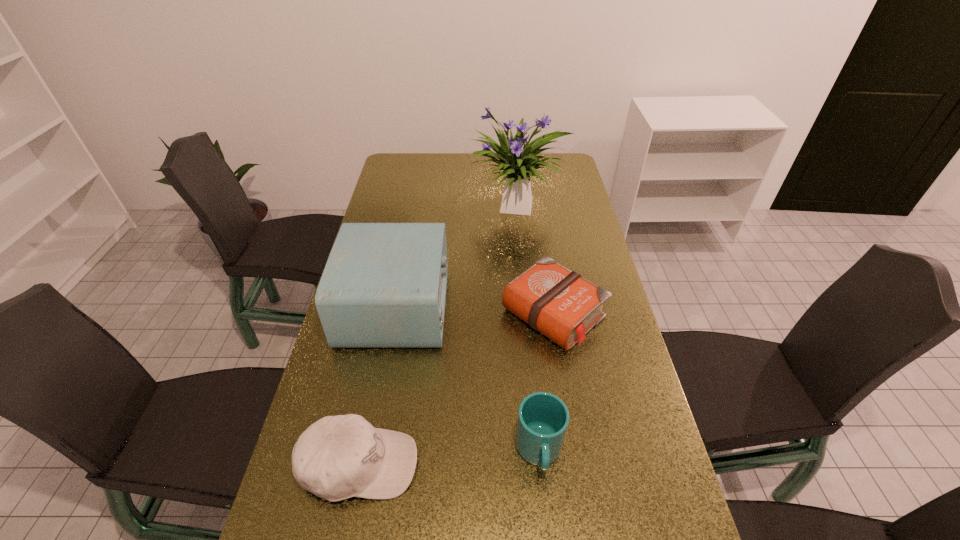
Find the location of a particular element. Image resolution: width=960 pixels, height=540 pixels. the tallest object is located at coordinates (517, 198).

Where is `flower arrangement`? The width and height of the screenshot is (960, 540). flower arrangement is located at coordinates (517, 198).

Locate an element on the screen. radio receiver is located at coordinates 384,285.

The height and width of the screenshot is (540, 960). In order to click on cup in this screenshot , I will do `click(543, 418)`.

The width and height of the screenshot is (960, 540). What are the coordinates of `baseball cap` in the screenshot? It's located at (338, 457).

The height and width of the screenshot is (540, 960). I want to click on Bible, so click(x=559, y=303).

Identify the location of blank area located 0.150m on the left of the farthest object. (430, 208).

Where is `vacant space positioned 0.220m on the front panel of the radio receiver`? vacant space positioned 0.220m on the front panel of the radio receiver is located at coordinates (519, 306).

This screenshot has height=540, width=960. What are the coordinates of `free spot located 0.100m on the handle side of the cup` in the screenshot? It's located at (547, 534).

The height and width of the screenshot is (540, 960). Identify the location of vacant space situated on the front-facing side of the baseball cap. (485, 464).